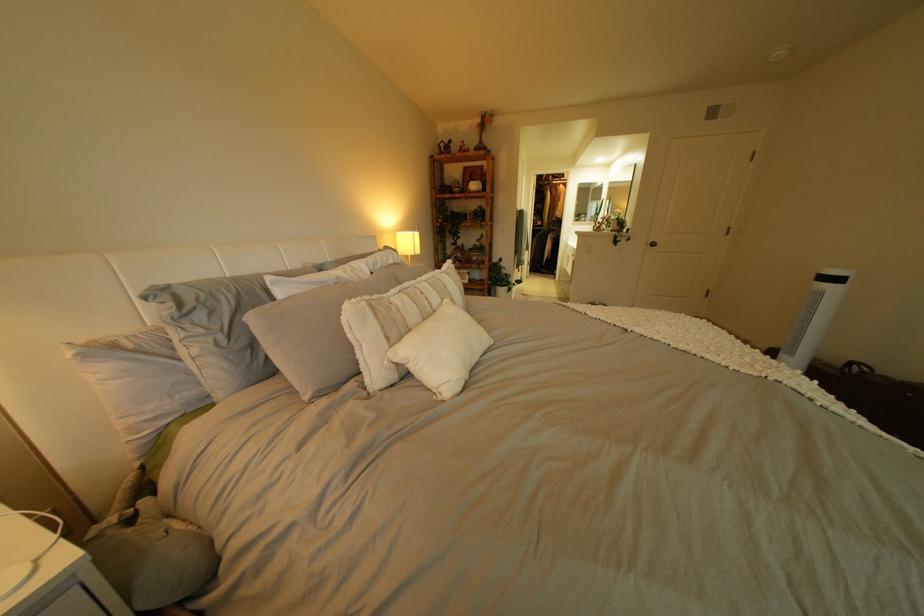
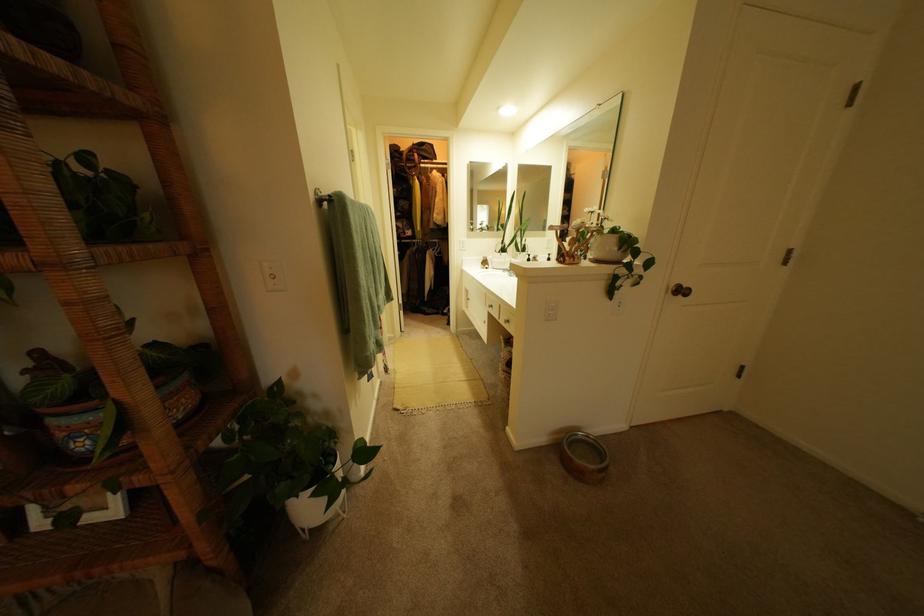
Question: Which direction would the cameraman need to move to produce the second image? Reply with the corresponding letter.

Choices:
 (A) Left
 (B) Right
 (C) Forward
 (D) Backward

Answer: (C)